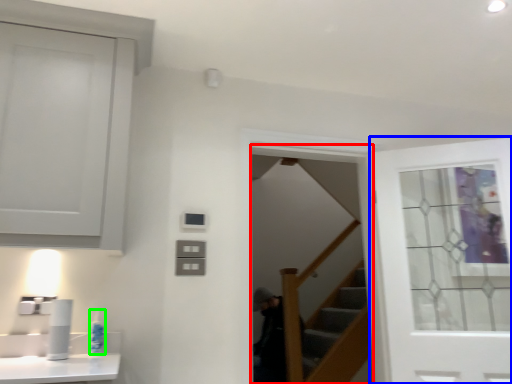
Question: Which object is positioned closest to screen door (highlighted by a red box)? Select from door (highlighted by a blue box) and toiletry (highlighted by a green box).

Choices:
 (A) door
 (B) toiletry

Answer: (A)